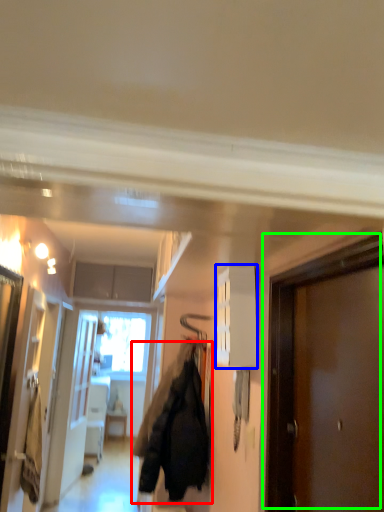
Question: Based on their relative distances, which object is farther from jacket (highlighted by a red box)? Choose from cabinetry (highlighted by a blue box) and door (highlighted by a green box).

Choices:
 (A) cabinetry
 (B) door

Answer: (B)